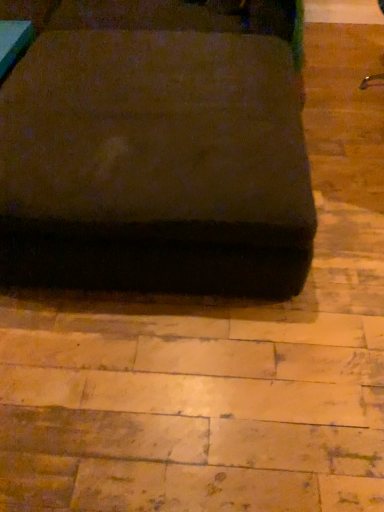
Describe the element at coordinates (157, 151) in the screenshot. Image resolution: width=384 pixels, height=512 pixels. I see `brown fabric ottoman at center` at that location.

The height and width of the screenshot is (512, 384). I want to click on brown fabric ottoman at center, so click(x=157, y=151).

Locate an element on the screen. brown fabric ottoman at center is located at coordinates (157, 151).